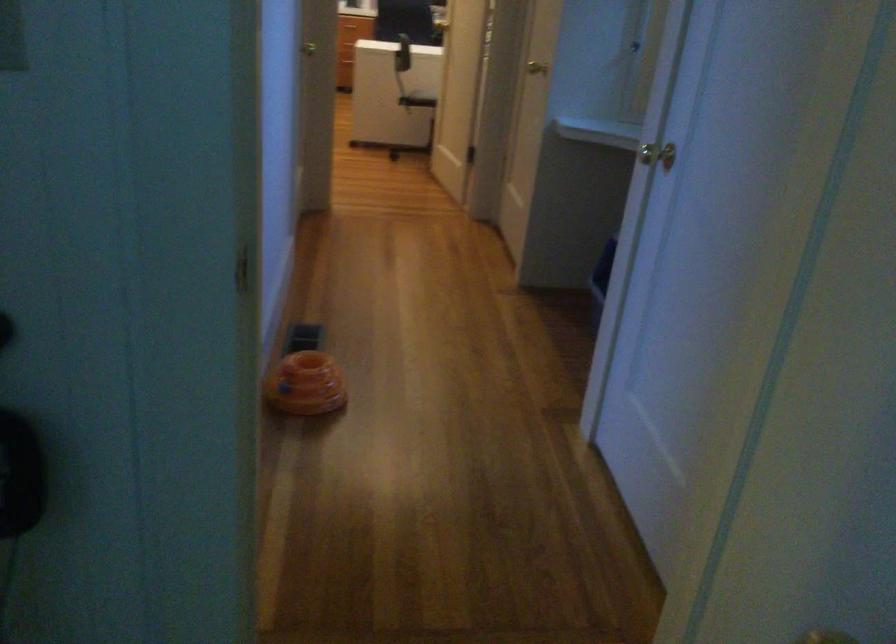
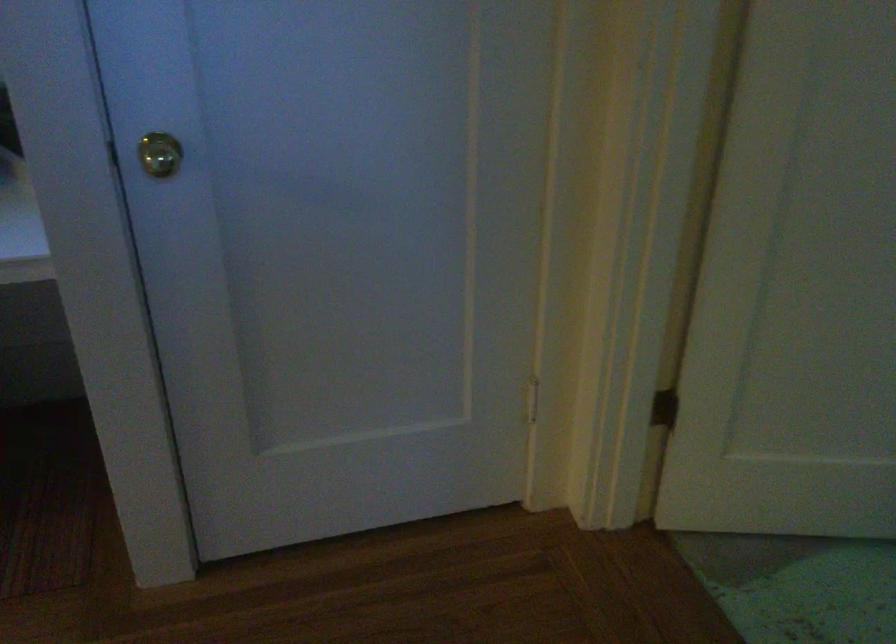
Find the pixel in the second image that matches (666,131) in the first image.

(159, 154)